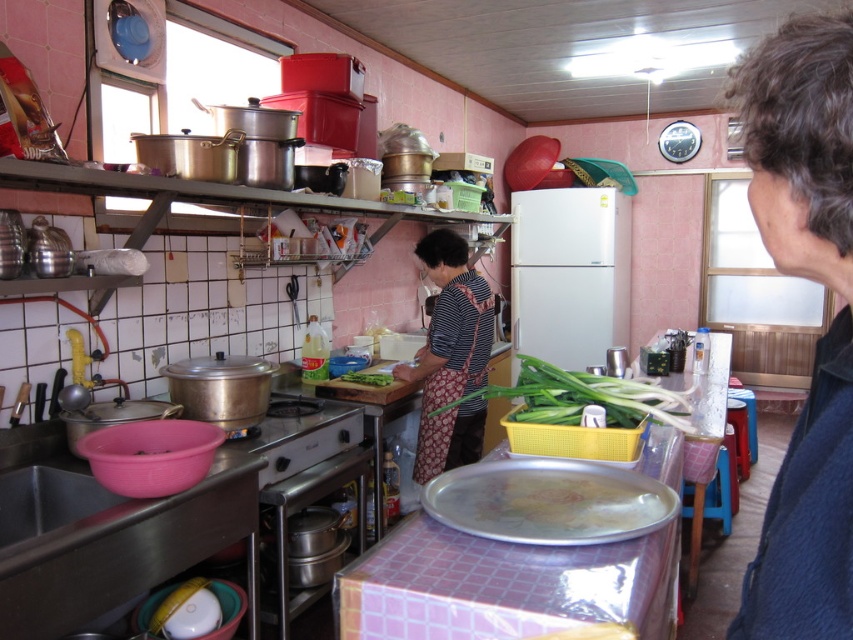
Question: Which object is the farthest from the green leafy vegetable at center?

Choices:
 (A) green leafy vegetables at center
 (B) metallic silver tray at center

Answer: (B)

Question: Can you confirm if striped fabric apron at center is bigger than green leafy vegetables at center?

Choices:
 (A) yes
 (B) no

Answer: (B)

Question: Does metallic silver tray at center have a smaller size compared to green leafy vegetables at center?

Choices:
 (A) no
 (B) yes

Answer: (B)

Question: Which point is farther from the camera taking this photo?

Choices:
 (A) (529, 493)
 (B) (369, 372)
 (C) (482, 413)
 (D) (585, 388)

Answer: (C)

Question: Among these points, which one is nearest to the camera?

Choices:
 (A) (379, 381)
 (B) (524, 531)
 (C) (589, 401)

Answer: (B)

Question: Can you confirm if striped fabric apron at center is positioned to the right of green leafy vegetable at center?

Choices:
 (A) yes
 (B) no

Answer: (A)